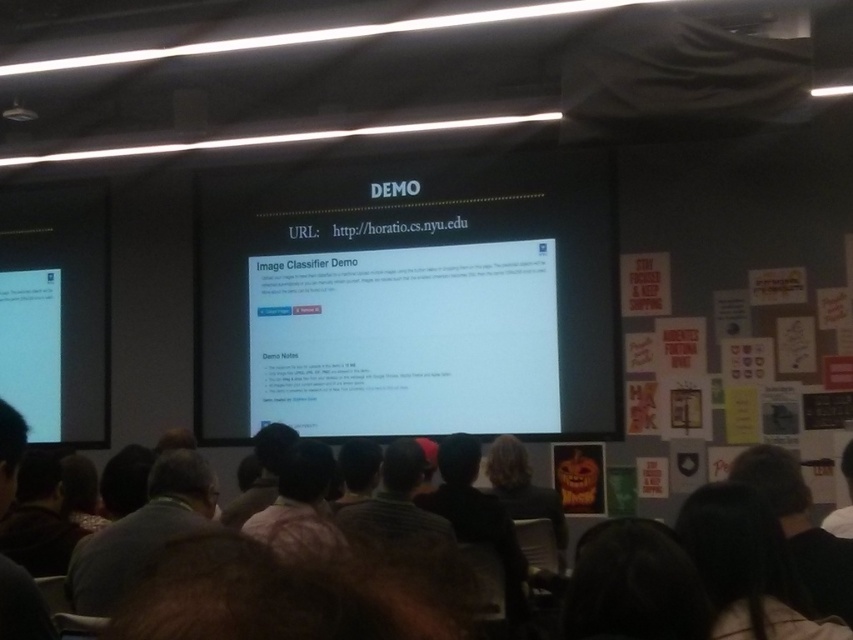
Question: Can you confirm if dark hair at lower right is positioned above dark brown fabric at lower left?

Choices:
 (A) yes
 (B) no

Answer: (A)

Question: Which of the following is the closest to the observer?

Choices:
 (A) (357, 241)
 (B) (730, 625)

Answer: (B)

Question: Estimate the real-world distances between objects in this image. Which object is farther from the dark brown hair at lower right?

Choices:
 (A) dark brown fabric at lower left
 (B) dark brown hair at center
 (C) black fur at center

Answer: (B)

Question: Does white glossy projector screen at center appear on the left side of black fur at center?

Choices:
 (A) no
 (B) yes

Answer: (A)

Question: Is dark brown hair at lower right positioned before black fur at center?

Choices:
 (A) no
 (B) yes

Answer: (B)

Question: Estimate the real-world distances between objects in this image. Which object is farther from the dark hair at lower right?

Choices:
 (A) dark brown hair at lower right
 (B) dark brown fabric at lower left

Answer: (B)